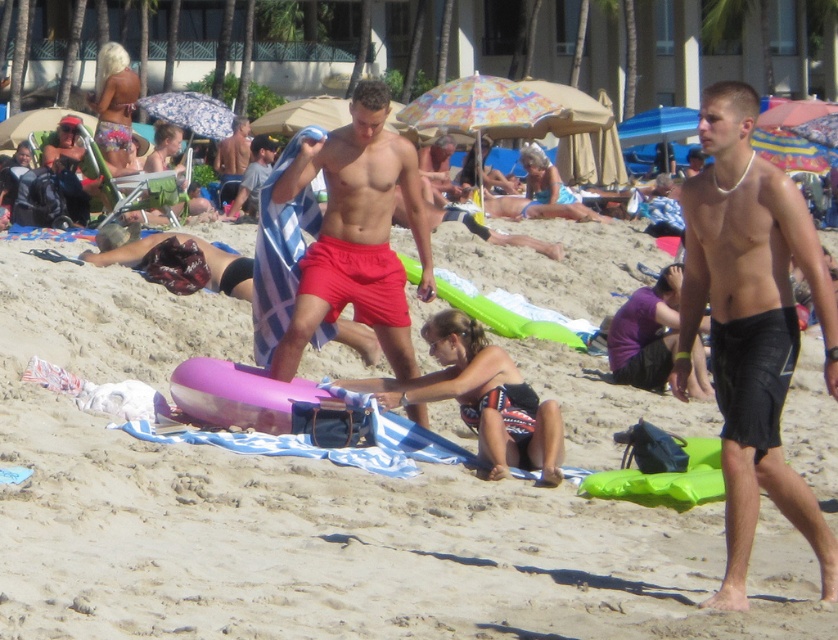
You are a photographer standing on the beach and want to take a picture of the pink foam float at center and the shiny blue towel at center. Which object should you place on the left side of your photo to ensure both are visible?

You should place the shiny blue towel at center on the left side of your photo because the pink foam float at center is positioned on the right side of it, ensuring both are visible.

You are a photographer trying to capture both the pink foam float at center and the shiny blue towel at center in the same frame. Which object should you focus on first to ensure both are in the frame?

The pink foam float at center is taller than the shiny blue towel at center, so focusing on the pink foam float at center first will ensure both objects are captured in the frame.

You are a photographer standing at the edge of the beach. You want to take a photo that includes both the pink foam float at center and the red matte shorts at center. What is the minimum distance you need to move backward to ensure both objects are in frame?

The minimum distance you need to move backward to include both the pink foam float at center and the red matte shorts at center is determined by the distance between them, which is 2.39 meters. To capture both in the frame, you should position yourself far enough back so that your camera can encompass this 2.39 meter span within its field of view.